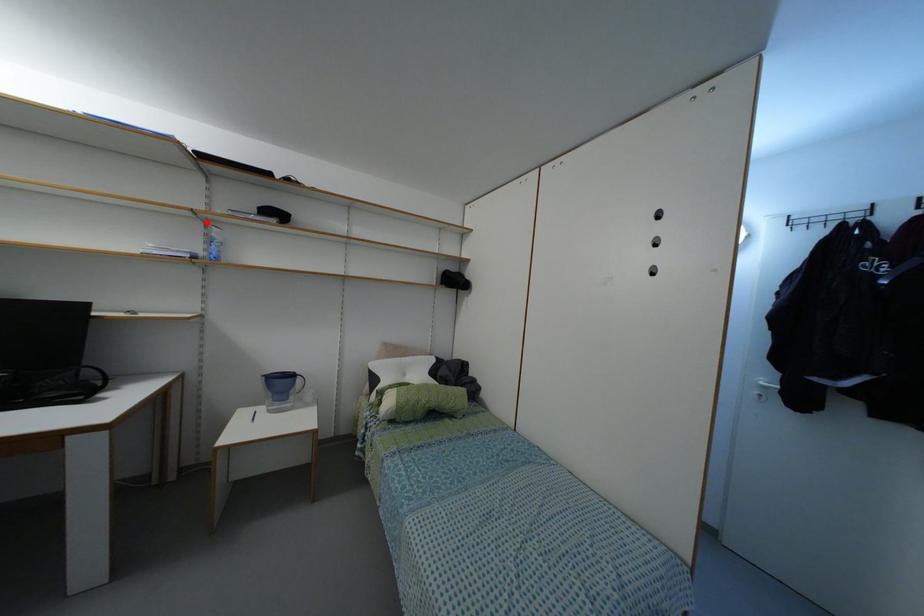
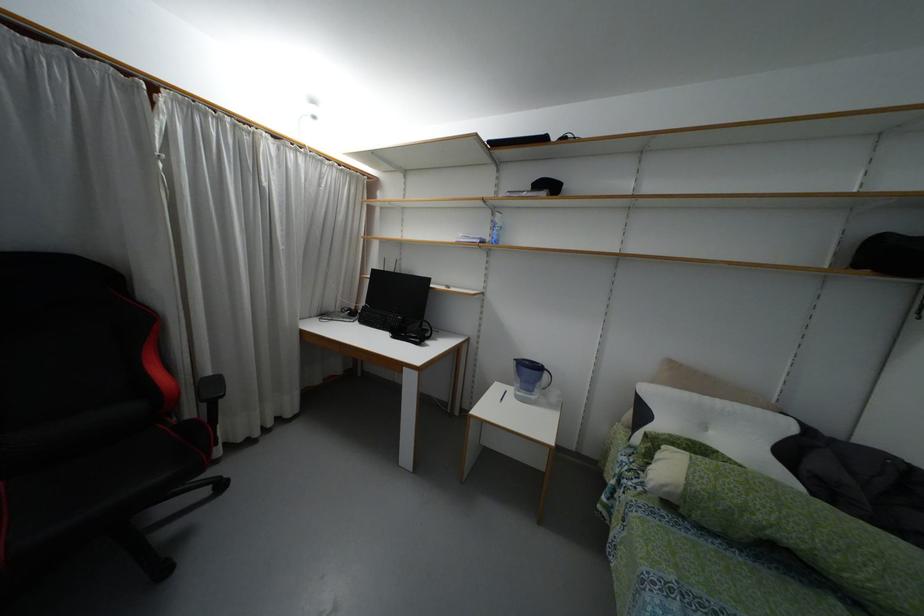
Question: I am providing you with two images of the same scene from different viewpoints. Image1 has a red point marked. In image2, the corresponding 3D location appears at what relative position? Reply with the corresponding letter.

Choices:
 (A) Closer
 (B) Farther

Answer: (A)